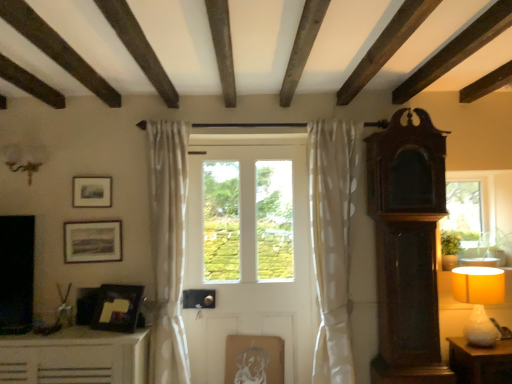
Question: From the image's perspective, is matte wooden picture frame at upper left, which is the second picture frame in left-to-right order, on top of white sheer curtain at left, which is the first curtain in left-to-right order?

Choices:
 (A) yes
 (B) no

Answer: (A)

Question: Does matte wooden picture frame at upper left, placed as the third picture frame when sorted from back to front, turn towards white sheer curtain at left, arranged as the second curtain when viewed from the right?

Choices:
 (A) yes
 (B) no

Answer: (B)

Question: Considering the relative sizes of matte wooden picture frame at upper left, the second picture frame from the front, and white sheer curtain at left, which is the first curtain in left-to-right order, in the image provided, is matte wooden picture frame at upper left, the second picture frame from the front, bigger than white sheer curtain at left, which is the first curtain in left-to-right order,?

Choices:
 (A) yes
 (B) no

Answer: (B)

Question: Considering the relative sizes of matte wooden picture frame at upper left, the second picture frame from the front, and white sheer curtain at left, arranged as the second curtain when viewed from the right, in the image provided, is matte wooden picture frame at upper left, the second picture frame from the front, thinner than white sheer curtain at left, arranged as the second curtain when viewed from the right,?

Choices:
 (A) yes
 (B) no

Answer: (A)

Question: Does matte wooden picture frame at upper left, placed as the third picture frame when sorted from back to front, come behind white sheer curtain at left, which is the first curtain in left-to-right order?

Choices:
 (A) yes
 (B) no

Answer: (A)

Question: Is point pos(340,276) positioned closer to the camera than point pos(29,147)?

Choices:
 (A) farther
 (B) closer

Answer: (B)

Question: From a real-world perspective, is white sheer curtain at center, arranged as the second curtain when viewed from the left, physically located above or below matte glass sconce at upper left?

Choices:
 (A) below
 (B) above

Answer: (A)

Question: From their relative heights in the image, would you say white sheer curtain at center, acting as the 1th curtain starting from the right, is taller or shorter than matte glass sconce at upper left?

Choices:
 (A) short
 (B) tall

Answer: (B)

Question: Considering the relative positions of white sheer curtain at center, acting as the 1th curtain starting from the right, and matte glass sconce at upper left in the image provided, is white sheer curtain at center, acting as the 1th curtain starting from the right, to the left or to the right of matte glass sconce at upper left?

Choices:
 (A) right
 (B) left

Answer: (A)

Question: Does point (247, 226) appear closer or farther from the camera than point (153, 225)?

Choices:
 (A) closer
 (B) farther

Answer: (B)

Question: From the image's perspective, is white matte door at center above or below white sheer curtain at left, which is the first curtain in left-to-right order?

Choices:
 (A) below
 (B) above

Answer: (A)

Question: Looking at the image, does white matte door at center seem bigger or smaller compared to white sheer curtain at left, which is the first curtain in left-to-right order?

Choices:
 (A) small
 (B) big

Answer: (A)

Question: From their relative heights in the image, would you say white matte door at center is taller or shorter than white sheer curtain at left, arranged as the second curtain when viewed from the right?

Choices:
 (A) tall
 (B) short

Answer: (A)

Question: From the image's perspective, is matte glass sconce at upper left located above or below white matte door at center?

Choices:
 (A) below
 (B) above

Answer: (B)

Question: Visually, is matte glass sconce at upper left positioned to the left or to the right of white matte door at center?

Choices:
 (A) left
 (B) right

Answer: (A)